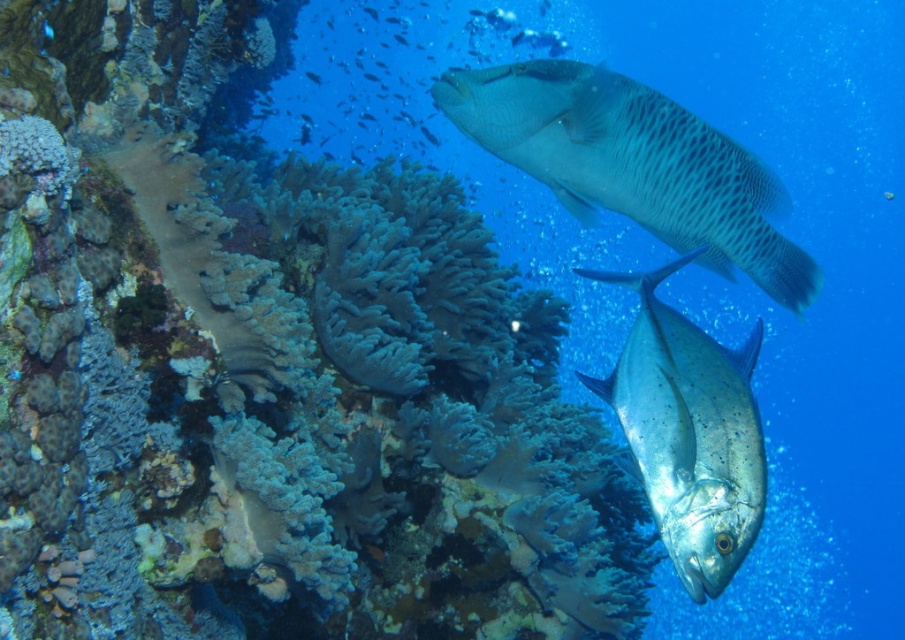
You are a marine biologist studying the coral reef. You observe a point marked at coordinates (270,371) in the image. Based on the underwater scene described, what type of coral is located at this point?

The point at coordinates (270,371) indicates soft coral at center.

You are a marine biologist observing this underwater scene. You notice the speckled gray fish at upper center and the silver metallic fish at center. Which fish is positioned higher in the water column?

The speckled gray fish at upper center is positioned higher in the water column than the silver metallic fish at center.